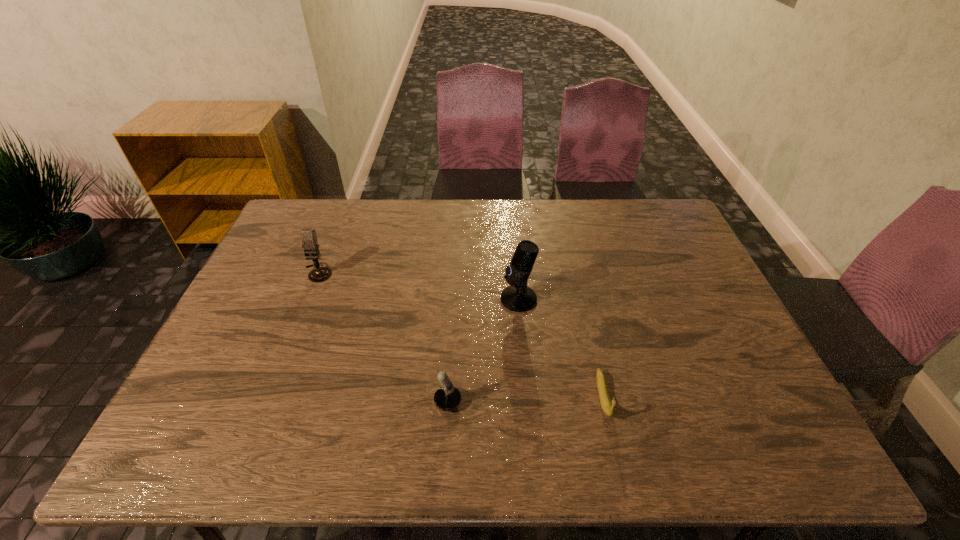
Locate an element on the screen. This screenshot has width=960, height=540. the third nearest object is located at coordinates (517, 297).

Locate an element on the screen. The image size is (960, 540). the second farthest microphone is located at coordinates (517, 297).

Image resolution: width=960 pixels, height=540 pixels. Identify the location of the farthest object. (310, 244).

Where is `the leftmost microphone`? The image size is (960, 540). the leftmost microphone is located at coordinates (310, 244).

What are the coordinates of `the second microphone from left to right` in the screenshot? It's located at (446, 398).

Find the location of a particular element. the second object from left to right is located at coordinates pyautogui.click(x=446, y=398).

The height and width of the screenshot is (540, 960). I want to click on the rightmost object, so click(608, 408).

Find the location of a particular element. banana is located at coordinates (608, 408).

Locate an element on the screen. This screenshot has height=540, width=960. free region located on the stand of the tallest microphone is located at coordinates (400, 299).

In order to click on vacant space located on the stand of the tallest microphone in this screenshot , I will do `click(480, 299)`.